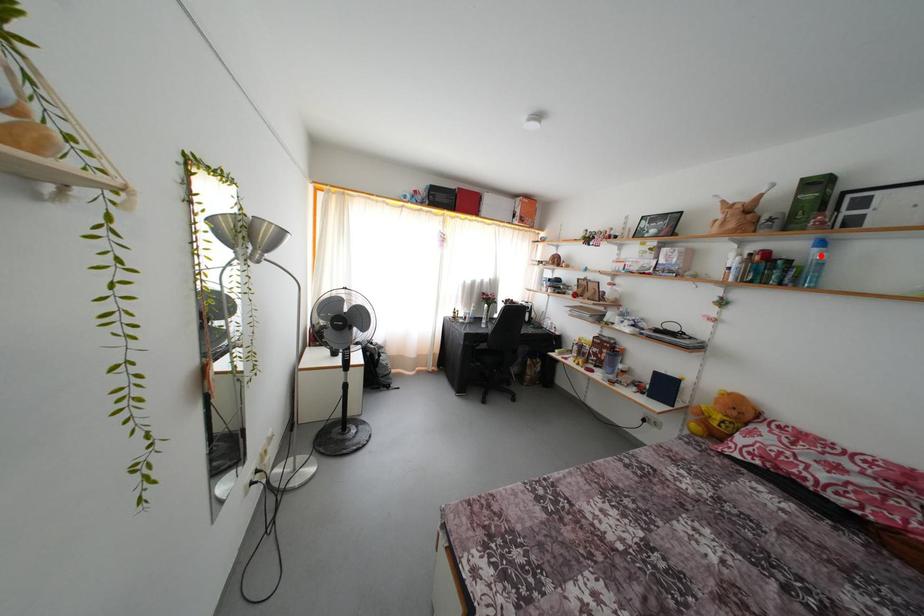
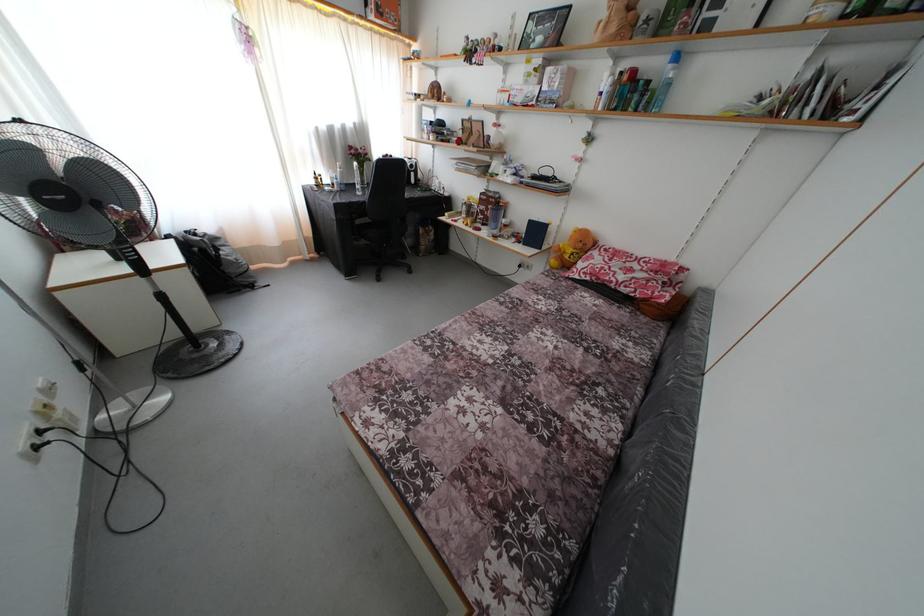
In the second image, find the point that corresponds to the highlighted location in the first image.

(675, 73)